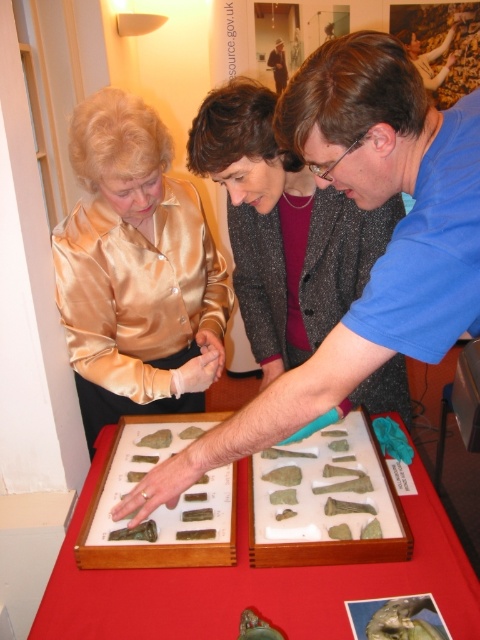
Can you confirm if satin gold blouse at upper left is positioned to the left of silky gold blouse at center?

Indeed, satin gold blouse at upper left is positioned on the left side of silky gold blouse at center.

Can you confirm if satin gold blouse at upper left is smaller than silky gold blouse at center?

Yes, satin gold blouse at upper left is smaller than silky gold blouse at center.

Which is in front, point (192, 276) or point (268, 310)?

Point (192, 276)

I want to click on satin gold blouse at upper left, so click(x=135, y=269).

Does silky gold blouse at center appear on the left side of green stone artifacts at center?

Incorrect, silky gold blouse at center is not on the left side of green stone artifacts at center.

Which is above, silky gold blouse at center or green stone artifacts at center?

silky gold blouse at center

Does point (298, 339) come farther from viewer compared to point (349, 634)?

That is True.

Identify the location of silky gold blouse at center. (283, 228).

Can you confirm if blue matte shirt at center is positioned to the left of satin gold blouse at upper left?

Incorrect, blue matte shirt at center is not on the left side of satin gold blouse at upper left.

Between point (479, 276) and point (129, 150), which one is positioned behind?

Positioned behind is point (129, 150).

This screenshot has width=480, height=640. Identify the location of blue matte shirt at center. (379, 259).